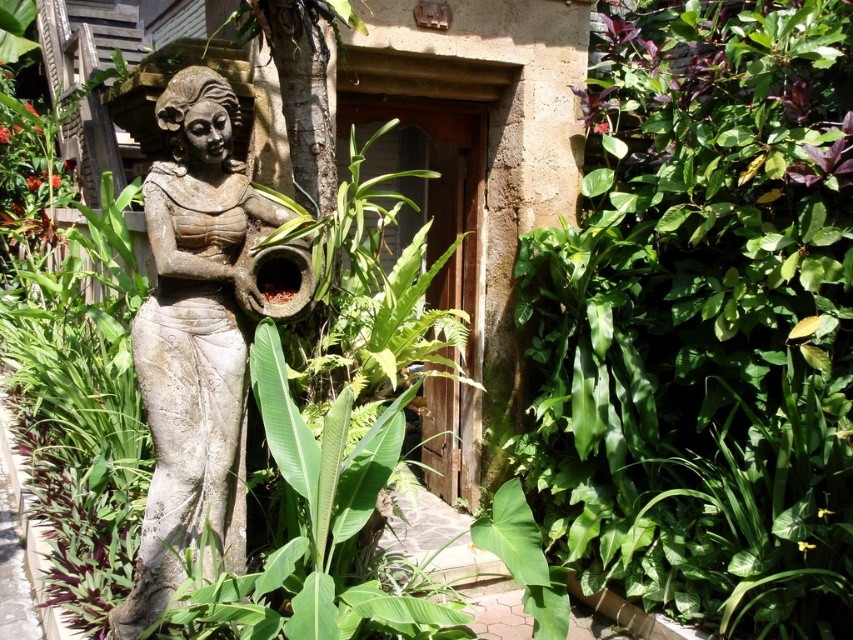
Does green leafy plant at center appear on the left side of stone statue at center?

Incorrect, green leafy plant at center is not on the left side of stone statue at center.

Can you confirm if green leafy plant at center is positioned to the right of stone statue at center?

Correct, you'll find green leafy plant at center to the right of stone statue at center.

Where is `green leafy plant at center`? The image size is (853, 640). green leafy plant at center is located at coordinates (703, 323).

What are the coordinates of `green leafy plant at center` in the screenshot? It's located at (703, 323).